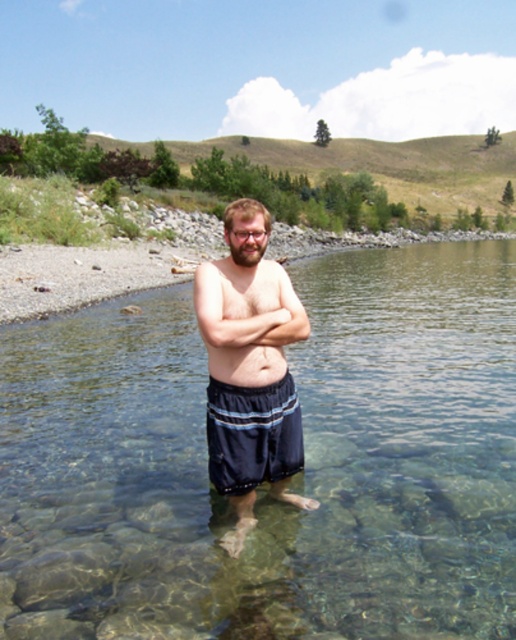
You are a photographer positioned at the edge of the water. You want to take a photo of the smooth skin arm at center. Considering your current position, will you need to move closer or farther away to get the arm into focus?

The smooth skin arm at center is 4.10 meters away from you. To get it into focus, you should stay at your current position since the distance is already optimal for clear focus.

You are a photographer trying to capture the person in the scene. Since both the dark blue shorts at center and the dark blue fabric shorts at center are part of the subject, can you confirm which one is closer to the camera?

The dark blue shorts at center is in front of dark blue fabric shorts at center, so the dark blue shorts at center is closer to the camera.